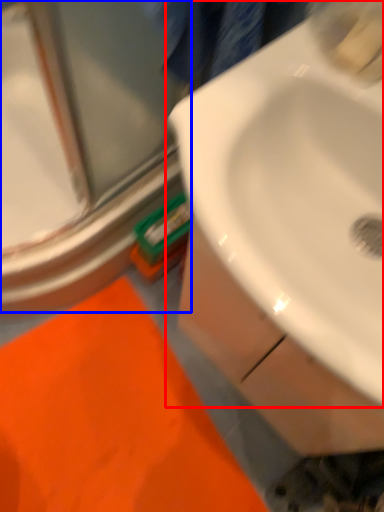
Question: Among these objects, which one is nearest to the camera, sink (highlighted by a red box) or glass door (highlighted by a blue box)?

Choices:
 (A) sink
 (B) glass door

Answer: (A)